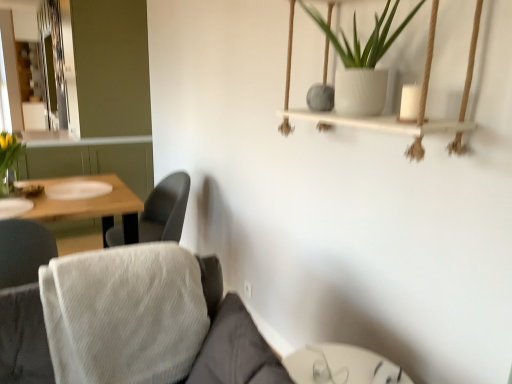
Question: Considering the relative sizes of clear glass vase at left and white fabric couch at lower left in the image provided, is clear glass vase at left smaller than white fabric couch at lower left?

Choices:
 (A) yes
 (B) no

Answer: (A)

Question: Does clear glass vase at left turn towards white fabric couch at lower left?

Choices:
 (A) no
 (B) yes

Answer: (A)

Question: Can you confirm if clear glass vase at left is positioned to the left of white fabric couch at lower left?

Choices:
 (A) yes
 (B) no

Answer: (A)

Question: Does clear glass vase at left have a larger size compared to white fabric couch at lower left?

Choices:
 (A) yes
 (B) no

Answer: (B)

Question: Is clear glass vase at left wider than white fabric couch at lower left?

Choices:
 (A) yes
 (B) no

Answer: (B)

Question: Is clear glass vase at left facing away from white fabric couch at lower left?

Choices:
 (A) no
 (B) yes

Answer: (B)

Question: From a real-world perspective, is gray fabric chair at center-left positioned under transparent glass table at lower center based on gravity?

Choices:
 (A) yes
 (B) no

Answer: (B)

Question: Is the position of gray fabric chair at center-left less distant than that of transparent glass table at lower center?

Choices:
 (A) yes
 (B) no

Answer: (B)

Question: Considering the relative positions of gray fabric chair at center-left and transparent glass table at lower center in the image provided, is gray fabric chair at center-left to the left of transparent glass table at lower center from the viewer's perspective?

Choices:
 (A) yes
 (B) no

Answer: (A)

Question: Is gray fabric chair at center-left looking in the opposite direction of transparent glass table at lower center?

Choices:
 (A) yes
 (B) no

Answer: (B)

Question: Is gray fabric chair at center-left positioned behind transparent glass table at lower center?

Choices:
 (A) no
 (B) yes

Answer: (B)

Question: Is transparent glass table at lower center inside gray fabric chair at center-left?

Choices:
 (A) no
 (B) yes

Answer: (A)

Question: Is gray fabric chair at center-left oriented away from clear glass vase at left?

Choices:
 (A) yes
 (B) no

Answer: (B)